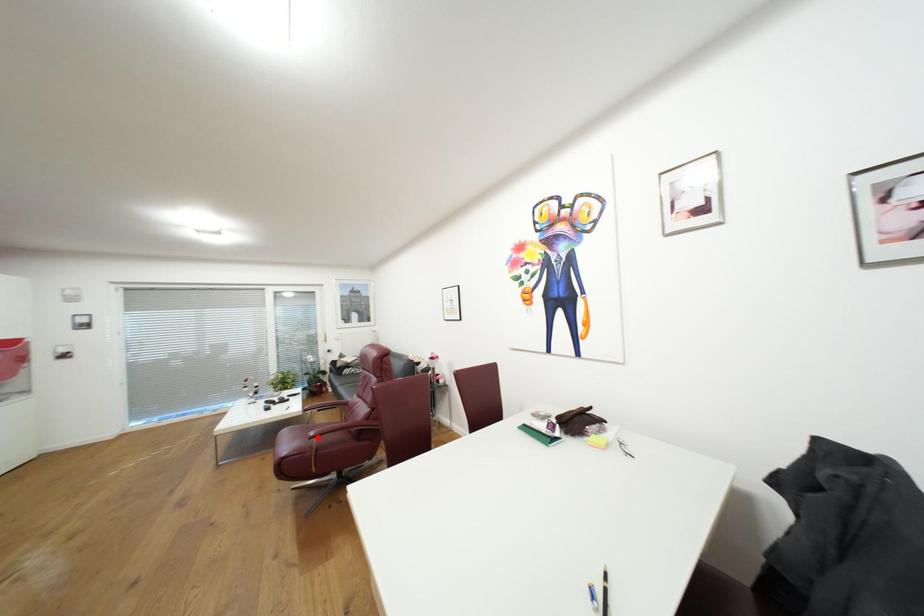
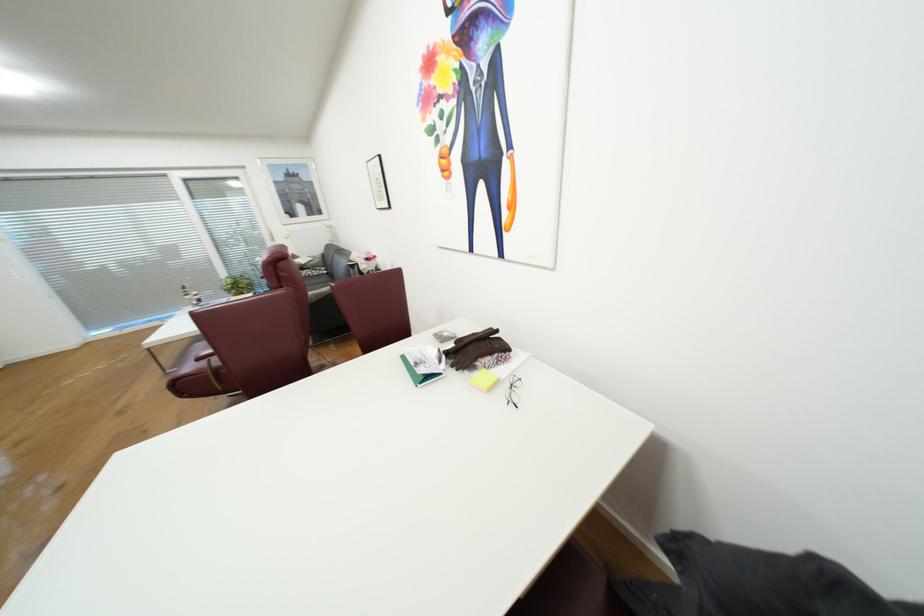
Question: I am providing you with two images of the same scene from different viewpoints. Given a red point in image1, look at the same physical point in image2. Is it:

Choices:
 (A) Closer to the viewpoint
 (B) Farther from the viewpoint

Answer: (B)